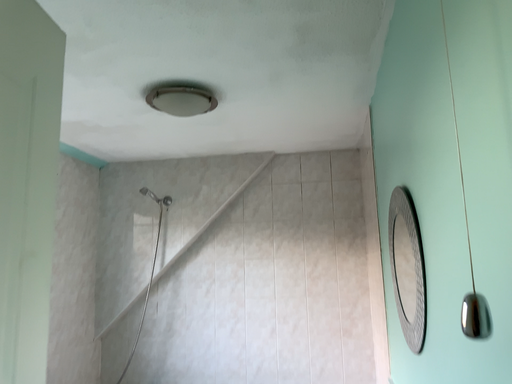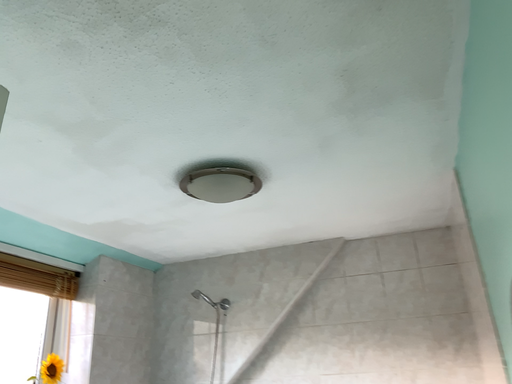
Question: How did the camera likely rotate when shooting the video?

Choices:
 (A) rotated downward
 (B) rotated upward

Answer: (B)